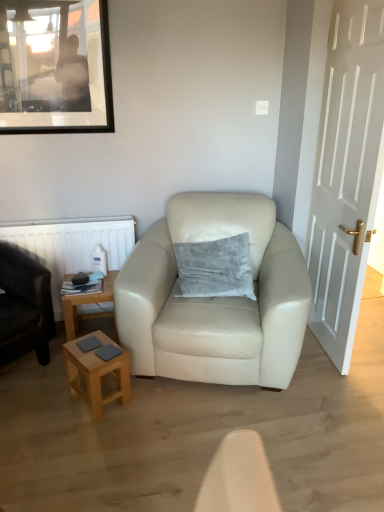
Question: Do you think white wooden door at right is within woodenwoodentable at lower left, or outside of it?

Choices:
 (A) inside
 (B) outside

Answer: (B)

Question: In the image, is white wooden door at right positioned in front of or behind woodenwoodentable at lower left?

Choices:
 (A) behind
 (B) front

Answer: (B)

Question: Considering the real-world distances, which object is farthest from the white plastic radiator at left?

Choices:
 (A) matte cream leather armchair at center, positioned as the 1th chair in right-to-left order
 (B) white wooden door at right
 (C) woodenwoodentable at lower left
 (D) light brown wooden stool at lower left
 (E) gray velvety pillow at center

Answer: (B)

Question: Estimate the real-world distances between objects in this image. Which object is closer to the white plastic radiator at left?

Choices:
 (A) matte black armchair at left, the 1th chair viewed from the left
 (B) gray velvety pillow at center
 (C) white wooden door at right
 (D) woodenwoodentable at lower left
 (E) light brown wooden stool at lower left

Answer: (D)